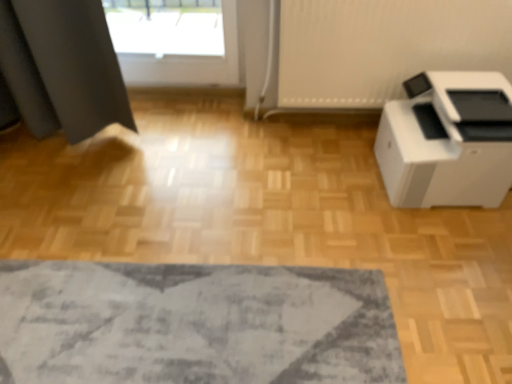
Question: Is textured gray rug at lower center in front of or behind white plastic printer at right in the image?

Choices:
 (A) behind
 (B) front

Answer: (B)

Question: Is textured gray rug at lower center inside the boundaries of white plastic printer at right, or outside?

Choices:
 (A) outside
 (B) inside

Answer: (A)

Question: Considering the positions of textured gray rug at lower center and white plastic printer at right in the image, is textured gray rug at lower center taller or shorter than white plastic printer at right?

Choices:
 (A) short
 (B) tall

Answer: (A)

Question: In the image, is white plastic printer at right positioned in front of or behind textured gray rug at lower center?

Choices:
 (A) behind
 (B) front

Answer: (A)

Question: Which is correct: white plastic printer at right is inside textured gray rug at lower center, or outside of it?

Choices:
 (A) outside
 (B) inside

Answer: (A)

Question: Considering the positions of white plastic printer at right and textured gray rug at lower center in the image, is white plastic printer at right bigger or smaller than textured gray rug at lower center?

Choices:
 (A) small
 (B) big

Answer: (B)

Question: Is white plastic printer at right taller or shorter than textured gray rug at lower center?

Choices:
 (A) short
 (B) tall

Answer: (B)